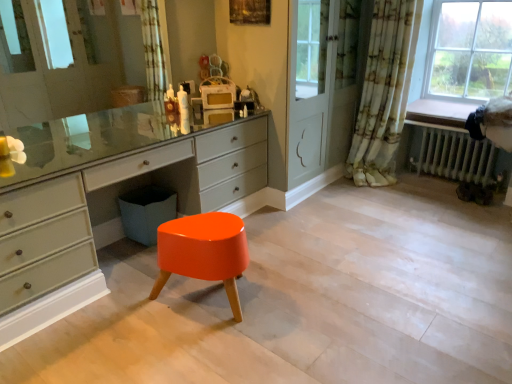
I want to click on free space in front of glossy orange stool at center, so click(205, 355).